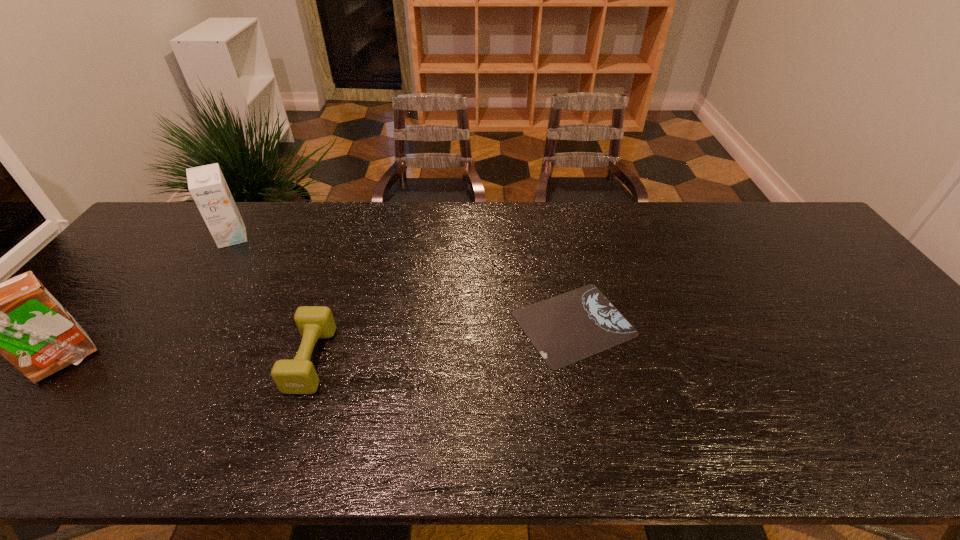
At what (x,y) coordinates should I click in order to perform the action: click on vacant space in between the mousepad and the second shortest object. Please return your answer as a coordinate pair (x, y). Image resolution: width=960 pixels, height=540 pixels. Looking at the image, I should click on (443, 341).

Locate an element on the screen. This screenshot has height=540, width=960. free spot between the farthest object and the left carton is located at coordinates (148, 299).

Locate an element on the screen. The width and height of the screenshot is (960, 540). free space between the farther carton and the shortest object is located at coordinates (403, 281).

Image resolution: width=960 pixels, height=540 pixels. I want to click on free point between the rightmost object and the left carton, so click(x=319, y=342).

Identify the location of vacant area that lies between the right carton and the leftmost object. (148, 299).

Where is `free area in between the second object from right to left and the mousepad`? This screenshot has width=960, height=540. free area in between the second object from right to left and the mousepad is located at coordinates pyautogui.click(x=443, y=341).

This screenshot has width=960, height=540. Find the location of `unoccupied area between the third object from left to right and the left carton`. unoccupied area between the third object from left to right and the left carton is located at coordinates (187, 360).

Locate an element on the screen. free space between the leftmost object and the farthest object is located at coordinates click(x=148, y=299).

Where is `object that is the closest to the rightmost object`? object that is the closest to the rightmost object is located at coordinates (292, 376).

The width and height of the screenshot is (960, 540). I want to click on object that is the second closest one to the third object from left to right, so click(x=567, y=328).